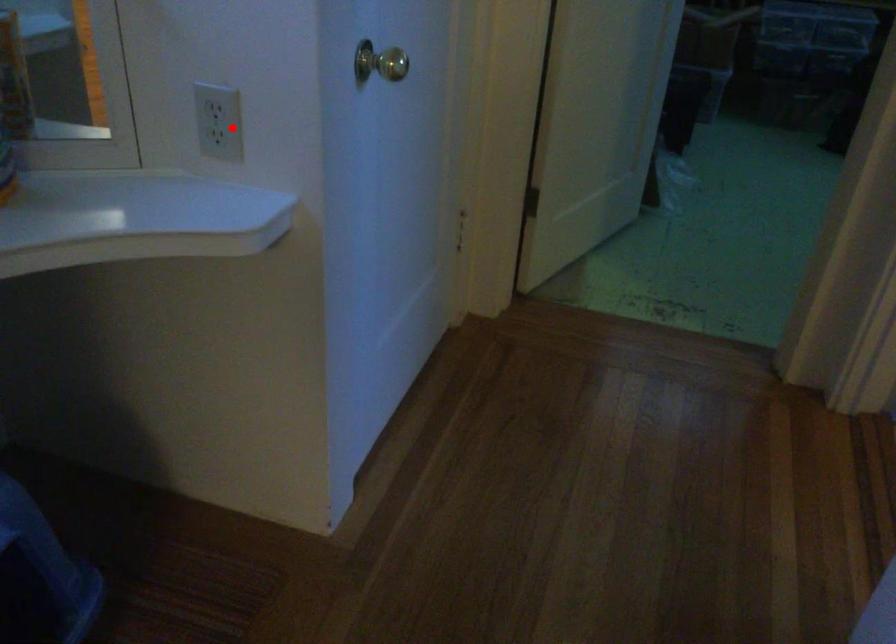
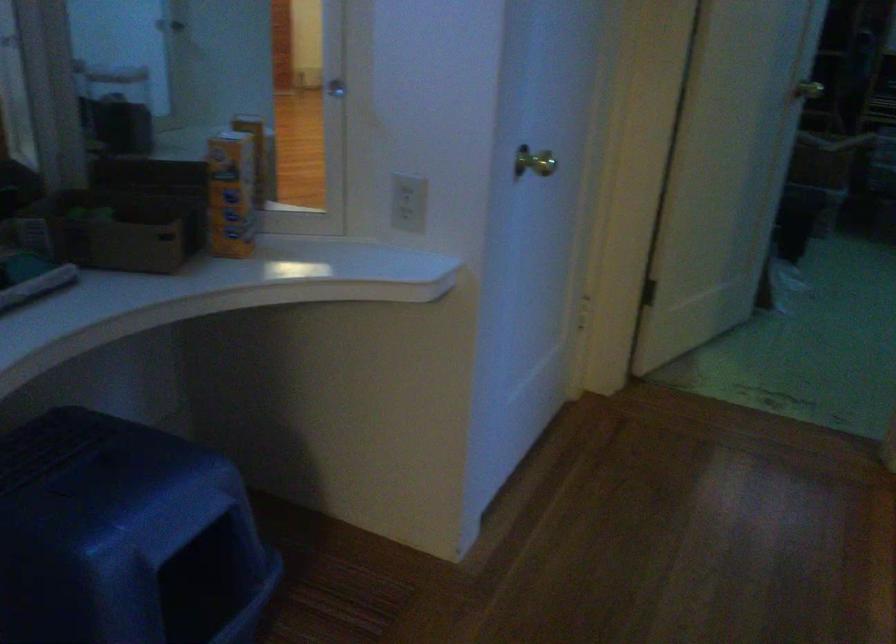
Question: I am providing you with two images of the same scene from different viewpoints. A red point is shown in image1. For the corresponding object point in image2, is it positioned nearer or farther from the camera?

Choices:
 (A) Nearer
 (B) Farther

Answer: (B)